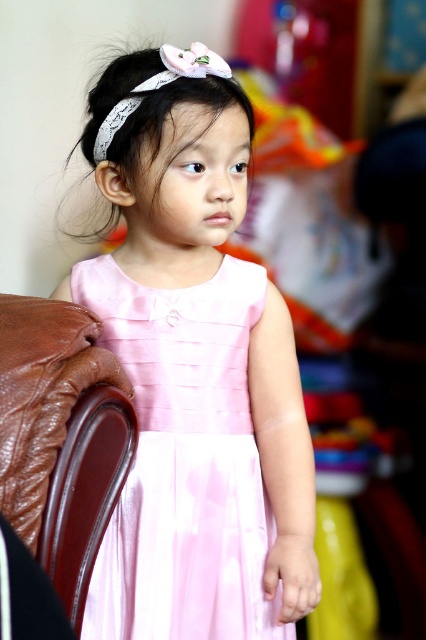
Is brown leather armchair at left thinner than white satin headband at upper center?

Yes, brown leather armchair at left is thinner than white satin headband at upper center.

Looking at this image, who is more forward, (5, 372) or (172, 61)?

Positioned in front is point (5, 372).

Image resolution: width=426 pixels, height=640 pixels. What do you see at coordinates (51, 458) in the screenshot?
I see `brown leather armchair at left` at bounding box center [51, 458].

This screenshot has height=640, width=426. In order to click on brown leather armchair at left in this screenshot , I will do `click(51, 458)`.

Who is taller, white lace headband at upper center or white satin headband at upper center?

With more height is white lace headband at upper center.

Does white lace headband at upper center appear under white satin headband at upper center?

Indeed, white lace headband at upper center is positioned under white satin headband at upper center.

Does point (89, 163) lie behind point (157, 84)?

That is True.

Image resolution: width=426 pixels, height=640 pixels. Find the location of `white lace headband at upper center`. white lace headband at upper center is located at coordinates (152, 100).

Measure the distance between brown leather armchair at left and white lace headband at upper center.

The distance of brown leather armchair at left from white lace headband at upper center is 39.99 centimeters.

Does brown leather armchair at left appear on the left side of white lace headband at upper center?

Yes, brown leather armchair at left is to the left of white lace headband at upper center.

Which is in front, point (37, 513) or point (115, 125)?

Point (37, 513)

I want to click on brown leather armchair at left, so click(51, 458).